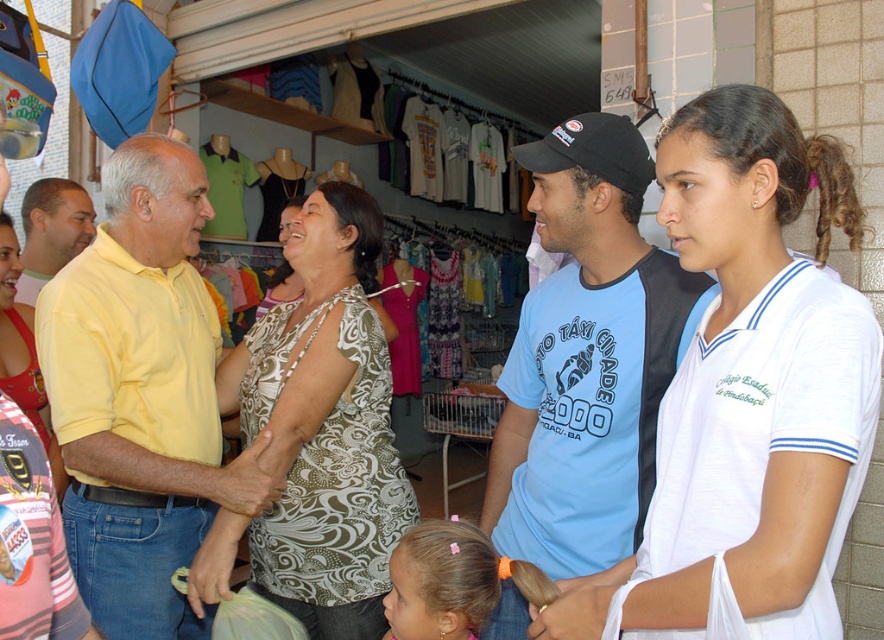
Can you confirm if white cotton shirt at center is shorter than black fabric baseball cap at center?

Incorrect, white cotton shirt at center's height does not fall short of black fabric baseball cap at center's.

Is white cotton shirt at center behind black fabric baseball cap at center?

No, it is in front of black fabric baseball cap at center.

Does point (733, 625) come behind point (629, 161)?

That is False.

The width and height of the screenshot is (884, 640). I want to click on white cotton shirt at center, so click(x=747, y=396).

Between white cotton shirt at center and yellow matte shirt at left, which one is positioned higher?

yellow matte shirt at left is higher up.

The width and height of the screenshot is (884, 640). What do you see at coordinates (747, 396) in the screenshot? I see `white cotton shirt at center` at bounding box center [747, 396].

The height and width of the screenshot is (640, 884). What do you see at coordinates (747, 396) in the screenshot? I see `white cotton shirt at center` at bounding box center [747, 396].

Where is `white cotton shirt at center`? white cotton shirt at center is located at coordinates (747, 396).

Can you confirm if white cotton shirt at center is smaller than blue t-shirt at center?

Indeed, white cotton shirt at center has a smaller size compared to blue t-shirt at center.

Does white cotton shirt at center have a greater width compared to blue t-shirt at center?

Indeed, white cotton shirt at center has a greater width compared to blue t-shirt at center.

Which is in front, point (761, 157) or point (509, 490)?

Positioned in front is point (761, 157).

At what (x,y) coordinates should I click in order to perform the action: click on white cotton shirt at center. Please return your answer as a coordinate pair (x, y). Looking at the image, I should click on (747, 396).